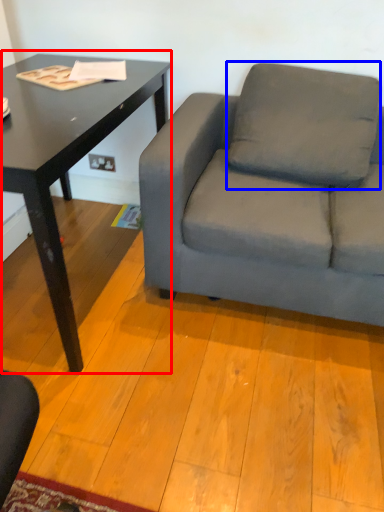
Question: Which of the following is the farthest to the observer, table (highlighted by a red box) or pillow (highlighted by a blue box)?

Choices:
 (A) table
 (B) pillow

Answer: (B)